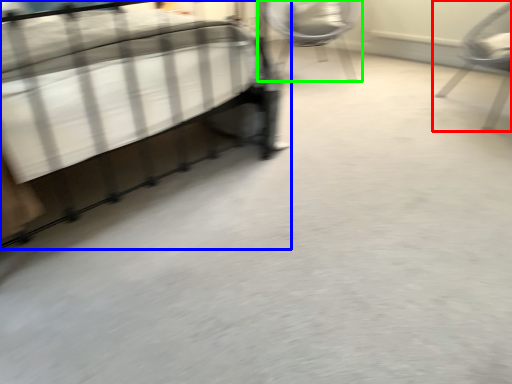
Question: Estimate the real-world distances between objects in this image. Which object is farther from chair (highlighted by a red box), bed (highlighted by a blue box) or chair (highlighted by a green box)?

Choices:
 (A) bed
 (B) chair

Answer: (A)